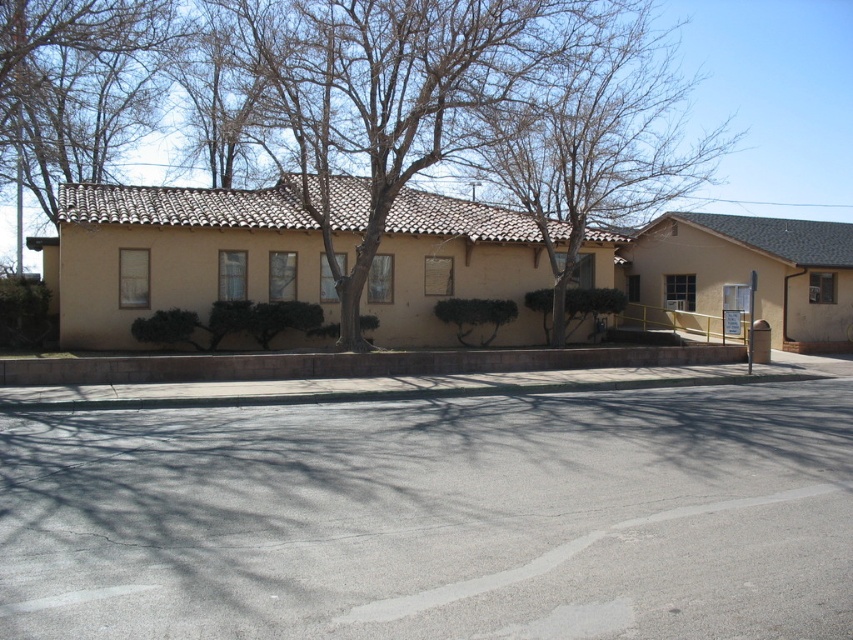
Based on the photo, you are a painter planning to paint the scene. You notice two sets of bare branches in the image. Which set of bare branches at center or bare branches at upper left is wider?

The bare branches at center are wider than the bare branches at upper left.

You are standing at the entrance of the building and looking towards the tree. Which set of bare branches, the bare branches at upper center or the bare branches at upper left, is positioned higher in the image?

The bare branches at upper center is positioned higher in the image than the bare branches at upper left.